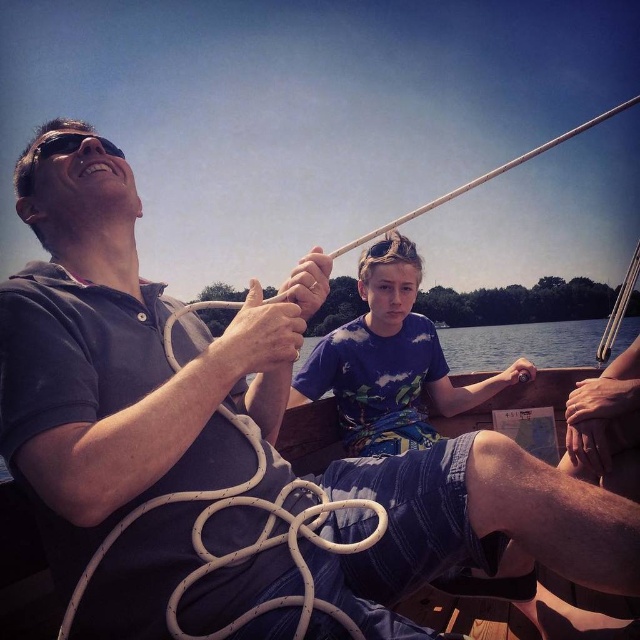
You are a photographer on the boat and want to take a picture of the blue printed shirt at center and the black matte sunglasses at upper left. Which object should you focus on first if you want to capture both clearly in the same frame?

The blue printed shirt at center has a smaller size compared to black matte sunglasses at upper left, so you should focus on the black matte sunglasses at upper left first to ensure both are in focus.

You are a photographer on the boat and want to take a photo of the two people. You notice the blue printed shirt at center and the black matte sunglasses at upper left. Which object is positioned to the right of the other?

The blue printed shirt at center is positioned to the right of the black matte sunglasses at upper left.

You are a photographer on the boat and want to capture a closeup shot of the white matte rope at center and the black matte sunglasses at upper left. Which object should you zoom in on more to ensure both are in focus?

The white matte rope at center is not as tall as the black matte sunglasses at upper left, so you should zoom in more on the white matte rope at center to ensure both are in focus.